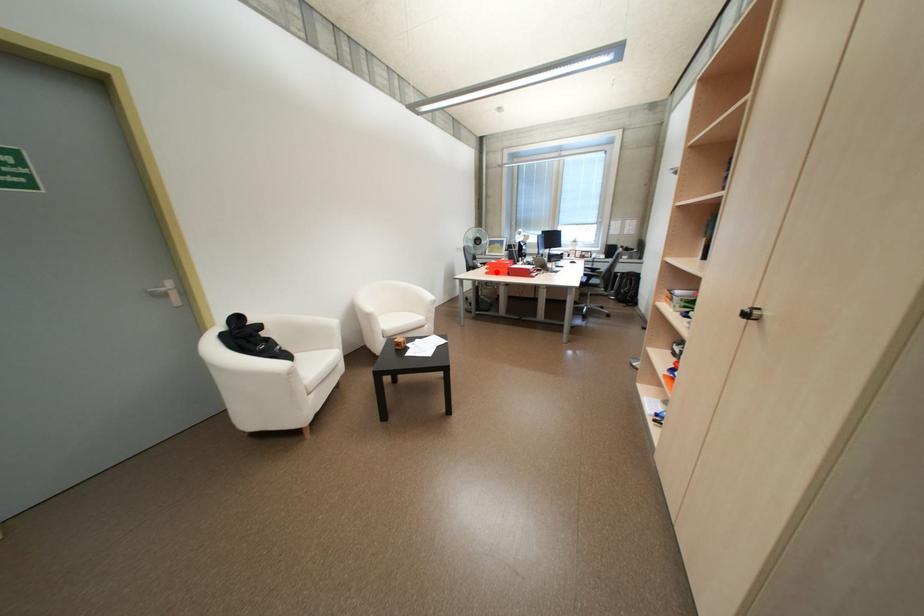
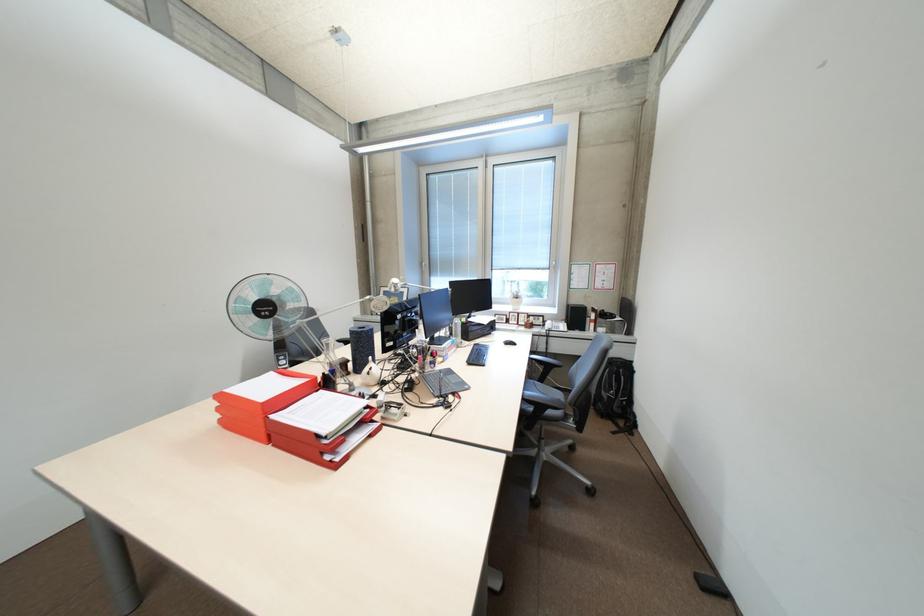
The point at the highlighted location is marked in the first image. Where is the corresponding point in the second image?

(231, 421)